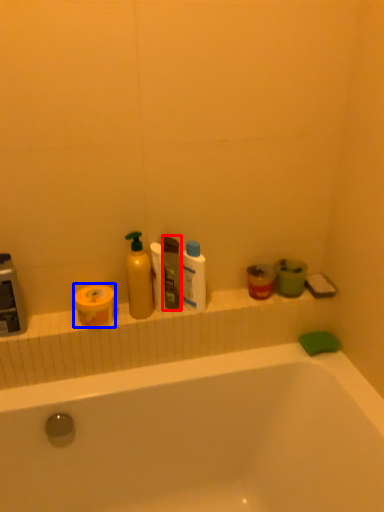
Question: Among these objects, which one is farthest to the camera, toiletry (highlighted by a red box) or toilet paper (highlighted by a blue box)?

Choices:
 (A) toiletry
 (B) toilet paper

Answer: (A)